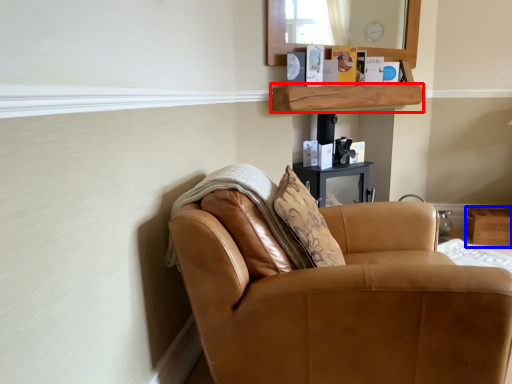
Question: Which object appears farthest to the camera in this image, shelf (highlighted by a red box) or box (highlighted by a blue box)?

Choices:
 (A) shelf
 (B) box

Answer: (B)